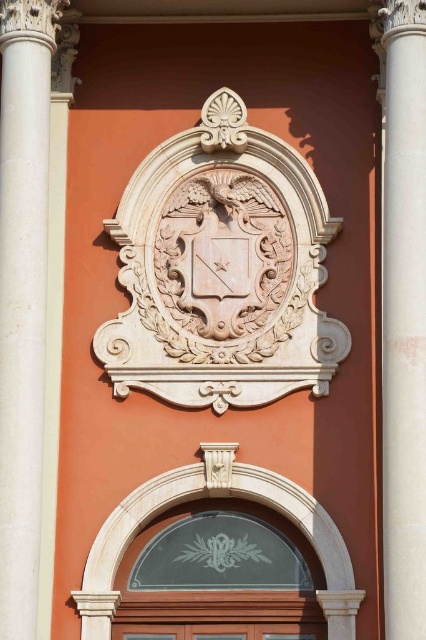
You are standing in front of a building with an ornate facade. You notice a point at coordinates (221, 269). What object is located at this point?

The point at (221, 269) is where the white stone coat of arms at center is located.

You are standing in front of the building and want to enter through the wooden door at lower center. Is the white marble column at center blocking your path to the door?

The white marble column at center is closer to the viewer than wooden door at lower center, so it is blocking the path to the wooden door at lower center.